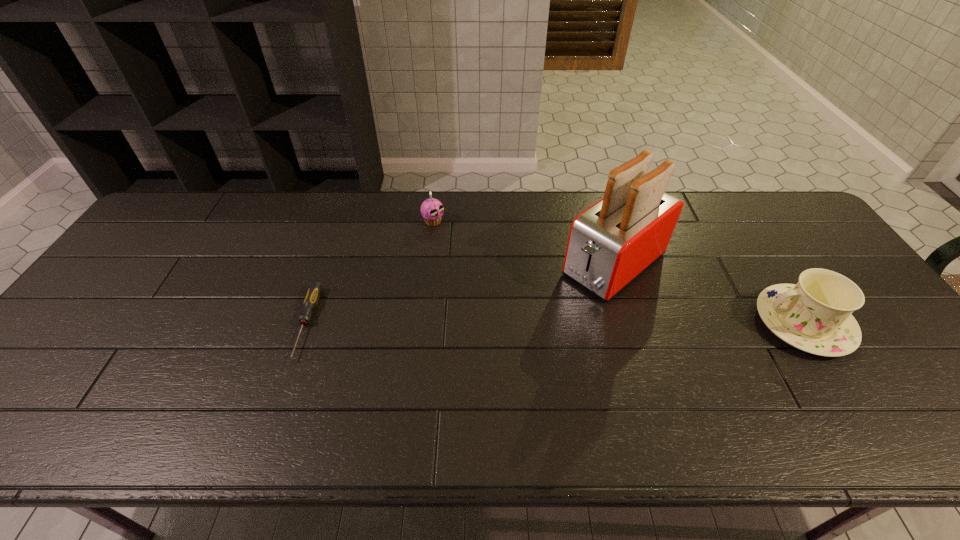
The width and height of the screenshot is (960, 540). Identify the location of free spot between the chinaware and the screwdriver. (555, 323).

I want to click on vacant space that is in between the third object from left to right and the shortest object, so click(x=461, y=294).

Where is `vacant space that is in between the tallest object and the shortest object`? This screenshot has height=540, width=960. vacant space that is in between the tallest object and the shortest object is located at coordinates click(461, 294).

Image resolution: width=960 pixels, height=540 pixels. I want to click on free space between the screwdriver and the third object from left to right, so click(x=461, y=294).

Image resolution: width=960 pixels, height=540 pixels. I want to click on free space between the shortest object and the third object from right to left, so click(x=370, y=273).

Locate which object ranks in proximity to the second object from left to right. Please provide its 2D coordinates. Your answer should be formatted as a tuple, i.e. [(x, y)], where the tuple contains the x and y coordinates of a point satisfying the conditions above.

[(612, 242)]

Locate which object ranks in proximity to the third object from right to left. Please provide its 2D coordinates. Your answer should be formatted as a tuple, i.e. [(x, y)], where the tuple contains the x and y coordinates of a point satisfying the conditions above.

[(612, 242)]

Identify the location of vacant area in the image that satisfies the following two spatial constraints: 1. on the front side of the chinaware; 2. on the handle side of the third object from left to right. This screenshot has width=960, height=540. (632, 323).

Identify the location of vacant region that satisfies the following two spatial constraints: 1. on the front side of the cupcake; 2. on the handle side of the chinaware. The image size is (960, 540). (421, 323).

Find the location of a particular element. Image resolution: width=960 pixels, height=540 pixels. free space that satisfies the following two spatial constraints: 1. on the front side of the rightmost object; 2. on the handle side of the third object from right to left is located at coordinates (421, 323).